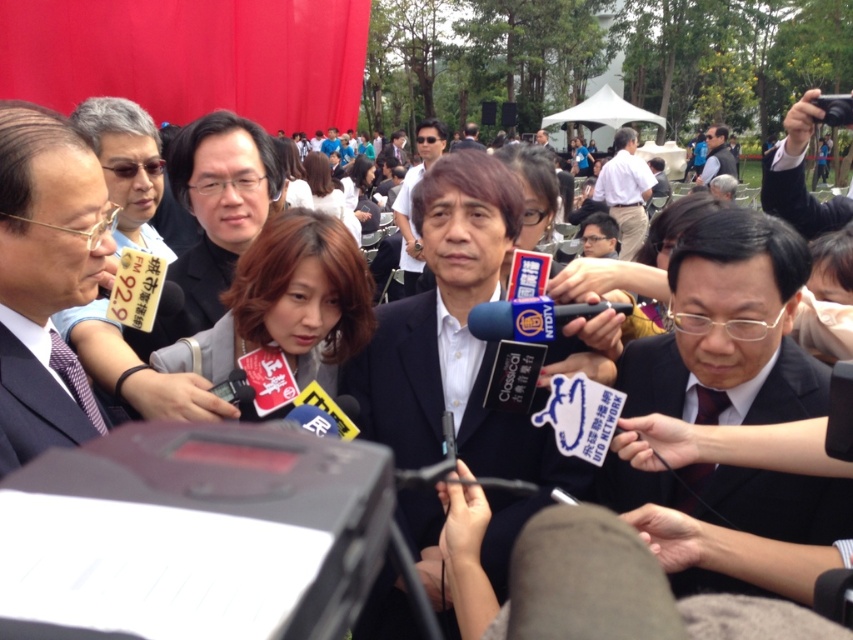
Question: Can you confirm if matte black suit at left is bigger than dark gray suit at upper right?

Choices:
 (A) no
 (B) yes

Answer: (A)

Question: Which point is farther from the camera taking this photo?

Choices:
 (A) (720, 138)
 (B) (421, 236)

Answer: (A)

Question: Is white shirt at center thinner than dark gray suit at upper right?

Choices:
 (A) yes
 (B) no

Answer: (A)

Question: Does matte black suit at center appear under dark blue suit at left?

Choices:
 (A) yes
 (B) no

Answer: (B)

Question: Which object is the farthest from the matte black suit at center?

Choices:
 (A) dark suit at center
 (B) dark blue suit at left
 (C) dark gray suit at upper right
 (D) white shirt at center

Answer: (C)

Question: Which point is closer to the camera taking this photo?

Choices:
 (A) (183, 148)
 (B) (440, 204)

Answer: (B)